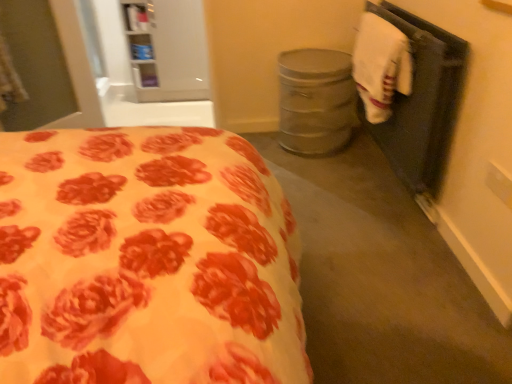
Question: From the image's perspective, is white fabric at right located beneath white cotton hand towel at right?

Choices:
 (A) yes
 (B) no

Answer: (A)

Question: Is white fabric at right to the right of white cotton hand towel at right from the viewer's perspective?

Choices:
 (A) yes
 (B) no

Answer: (A)

Question: From a real-world perspective, is white fabric at right on top of white cotton hand towel at right?

Choices:
 (A) yes
 (B) no

Answer: (B)

Question: Is white fabric at right facing towards white cotton hand towel at right?

Choices:
 (A) yes
 (B) no

Answer: (A)

Question: Is the depth of white fabric at right less than that of white cotton hand towel at right?

Choices:
 (A) yes
 (B) no

Answer: (A)

Question: From the image's perspective, is white fabric at right on white cotton hand towel at right?

Choices:
 (A) yes
 (B) no

Answer: (B)

Question: Is white cotton hand towel at right bigger than white fabric at right?

Choices:
 (A) yes
 (B) no

Answer: (B)

Question: Is white cotton hand towel at right not inside white fabric at right?

Choices:
 (A) yes
 (B) no

Answer: (A)

Question: Considering the relative positions of white cotton hand towel at right and white fabric at right in the image provided, is white cotton hand towel at right in front of white fabric at right?

Choices:
 (A) no
 (B) yes

Answer: (A)

Question: From a real-world perspective, is white cotton hand towel at right over white fabric at right?

Choices:
 (A) no
 (B) yes

Answer: (B)

Question: Considering the relative sizes of white cotton hand towel at right and white fabric at right in the image provided, is white cotton hand towel at right wider than white fabric at right?

Choices:
 (A) no
 (B) yes

Answer: (B)

Question: Considering the relative sizes of white cotton hand towel at right and white fabric at right in the image provided, is white cotton hand towel at right thinner than white fabric at right?

Choices:
 (A) yes
 (B) no

Answer: (B)

Question: Considering the relative positions of white fabric at right and white cotton hand towel at right in the image provided, is white fabric at right to the left or to the right of white cotton hand towel at right?

Choices:
 (A) left
 (B) right

Answer: (B)